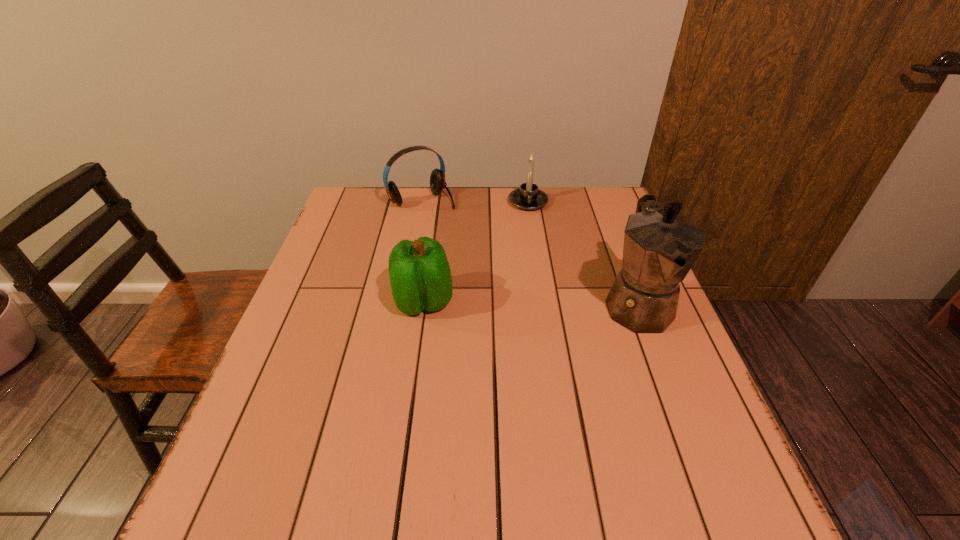
This screenshot has height=540, width=960. Find the location of `free spot between the candle holder and the tallest object`. free spot between the candle holder and the tallest object is located at coordinates (583, 253).

The width and height of the screenshot is (960, 540). I want to click on free space between the coffeepot and the third object from left to right, so click(x=583, y=253).

This screenshot has height=540, width=960. Find the location of `free space between the rightmost object and the headset`. free space between the rightmost object and the headset is located at coordinates (530, 252).

This screenshot has height=540, width=960. What are the coordinates of `free area in between the second object from right to left and the tallest object` in the screenshot? It's located at (583, 253).

Locate which object ranks second in proximity to the third object from left to right. Please provide its 2D coordinates. Your answer should be formatted as a tuple, i.e. [(x, y)], where the tuple contains the x and y coordinates of a point satisfying the conditions above.

[(660, 246)]

Locate which object ranks in proximity to the bell pepper. Please provide its 2D coordinates. Your answer should be formatted as a tuple, i.e. [(x, y)], where the tuple contains the x and y coordinates of a point satisfying the conditions above.

[(437, 179)]

I want to click on free space that satisfies the following two spatial constraints: 1. on the front side of the headset; 2. on the right side of the candle holder, so click(421, 202).